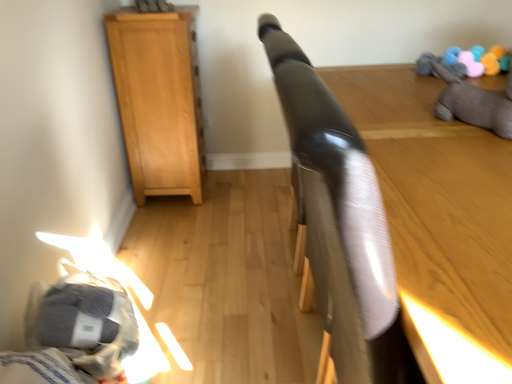
Where is `free space that is to the left of soft woolen balls at upper right`? free space that is to the left of soft woolen balls at upper right is located at coordinates (403, 84).